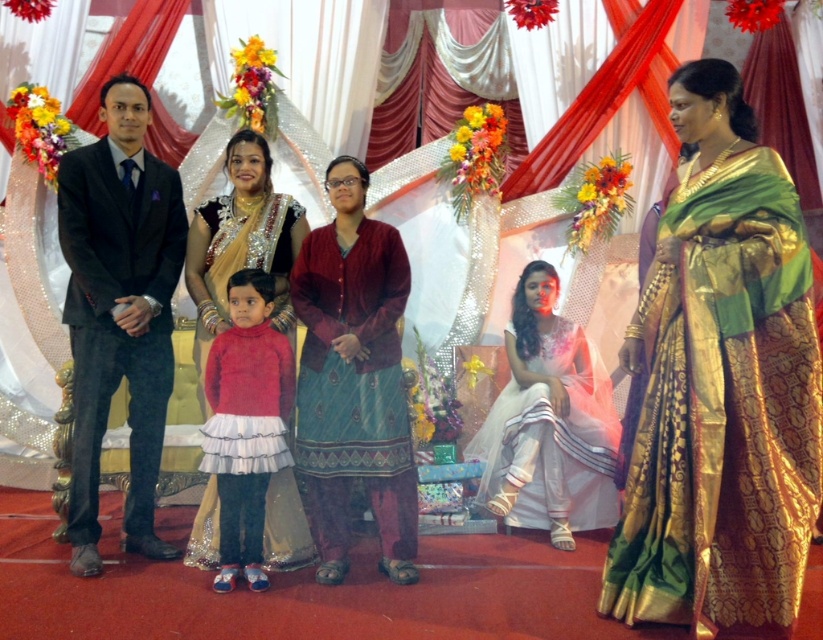
You are a photographer positioned at the back of the stage. The bride in green silk saree at center is seated on a raised platform. You want to take a closeup shot of her without moving the camera. Can you do it with a standard lens that has a focal length of 50mm? Explain your reasoning.

The photographer is 5.85 meters away from the bride in green silk saree at center. With a standard lens of 50mm, it might be challenging to capture a closeup shot from that distance without moving closer. A longer focal length would be more suitable for zooming in from such a far distance.